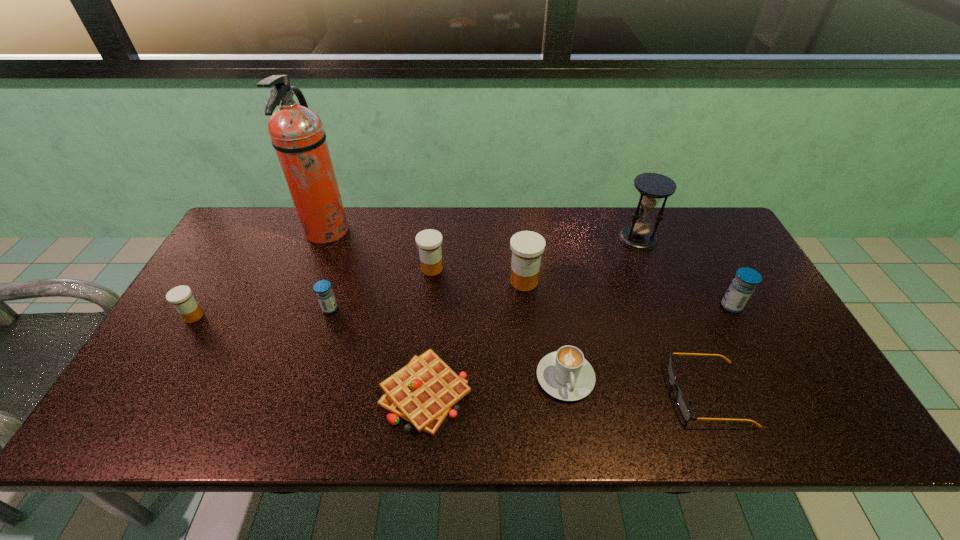
Where is `vacant point that satisfies the following two spatial constraints: 1. on the back side of the left blue medicine; 2. at the nozzle of the tallest object`? Image resolution: width=960 pixels, height=540 pixels. vacant point that satisfies the following two spatial constraints: 1. on the back side of the left blue medicine; 2. at the nozzle of the tallest object is located at coordinates (354, 232).

The width and height of the screenshot is (960, 540). What are the coordinates of `blank space that satisfies the following two spatial constraints: 1. at the nozzle of the tallest object; 2. on the back side of the rightmost medicine` in the screenshot? It's located at (298, 306).

Image resolution: width=960 pixels, height=540 pixels. Identify the location of free location that satisfies the following two spatial constraints: 1. on the label of the third tallest object; 2. on the front side of the left blue medicine. (x=527, y=309).

Locate an element on the screen. free space that satisfies the following two spatial constraints: 1. at the nozzle of the waffle; 2. on the left side of the tallest object is located at coordinates (264, 393).